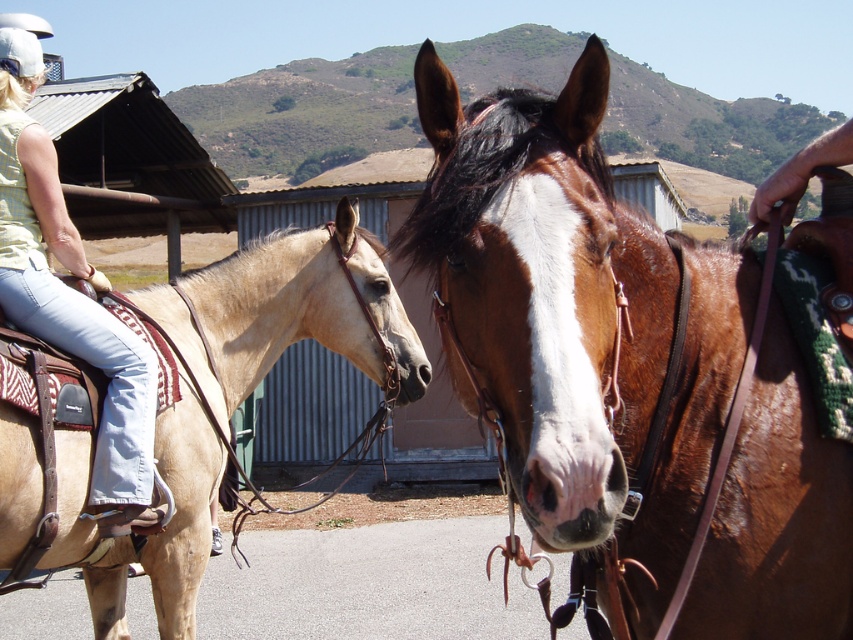
Question: Which point is closer to the camera taking this photo?

Choices:
 (A) (97, 282)
 (B) (347, 330)

Answer: (A)

Question: Is light tan leather saddle at left closer to the viewer compared to denim jeans at left?

Choices:
 (A) no
 (B) yes

Answer: (B)

Question: Among these objects, which one is nearest to the camera?

Choices:
 (A) brown glossy horse at center
 (B) denim jeans at left
 (C) light tan leather saddle at left

Answer: (A)

Question: Is light tan leather saddle at left to the left of denim jeans at left from the viewer's perspective?

Choices:
 (A) yes
 (B) no

Answer: (B)

Question: Which object is the closest to the denim jeans at left?

Choices:
 (A) light tan leather saddle at left
 (B) brown glossy horse at center

Answer: (A)

Question: Can you confirm if brown glossy horse at center is positioned to the left of light tan leather saddle at left?

Choices:
 (A) no
 (B) yes

Answer: (A)